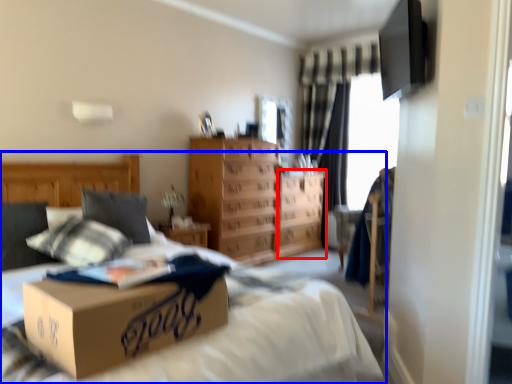
Question: Which of the following is the farthest to the observer, vanity (highlighted by a red box) or bed (highlighted by a blue box)?

Choices:
 (A) vanity
 (B) bed

Answer: (A)